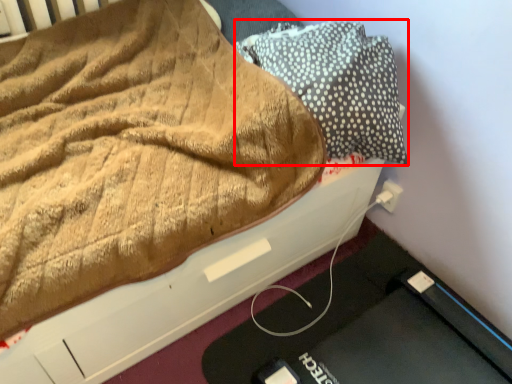
Question: From the image's perspective, what is the correct spatial relationship of pillow (annotated by the red box) in relation to electric outlet?

Choices:
 (A) below
 (B) above

Answer: (B)